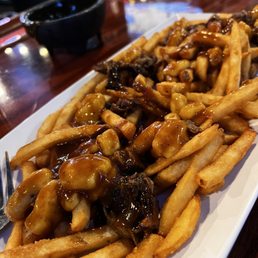
The height and width of the screenshot is (258, 258). In order to click on scratch in table in this screenshot , I will do `click(35, 105)`.